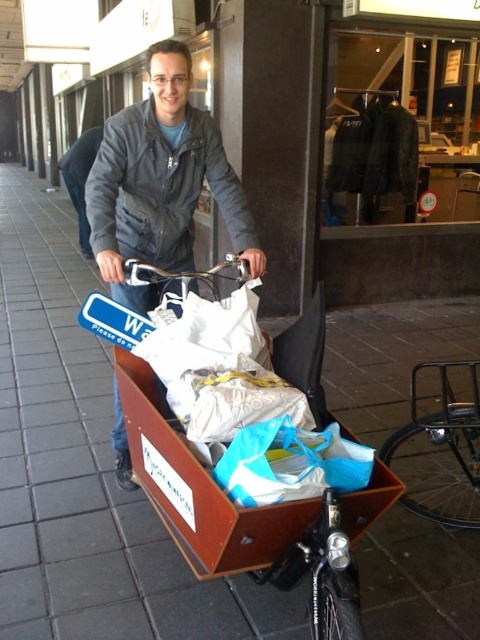
Can you confirm if matte black jacket at center is bigger than blue plastic bag at center?

Correct, matte black jacket at center is larger in size than blue plastic bag at center.

Is point (176, 216) in front of point (259, 499)?

No, (176, 216) is further to viewer.

Is point (261, 266) closer to camera compared to point (364, 454)?

No, (261, 266) is further to viewer.

Image resolution: width=480 pixels, height=640 pixels. I want to click on matte black jacket at center, so click(162, 182).

Can you confirm if brown tile pavement at center is wider than dark gray jacket at center?

Correct, the width of brown tile pavement at center exceeds that of dark gray jacket at center.

Between brown tile pavement at center and dark gray jacket at center, which one appears on the left side from the viewer's perspective?

Positioned to the left is dark gray jacket at center.

The height and width of the screenshot is (640, 480). I want to click on brown tile pavement at center, so click(x=85, y=467).

How far apart are matte black jacket at center and dark gray jacket at center?

matte black jacket at center and dark gray jacket at center are 4.87 meters apart from each other.

Does point (240, 236) come closer to viewer compared to point (72, 156)?

Yes.

Locate an element on the screen. This screenshot has height=640, width=480. matte black jacket at center is located at coordinates (162, 182).